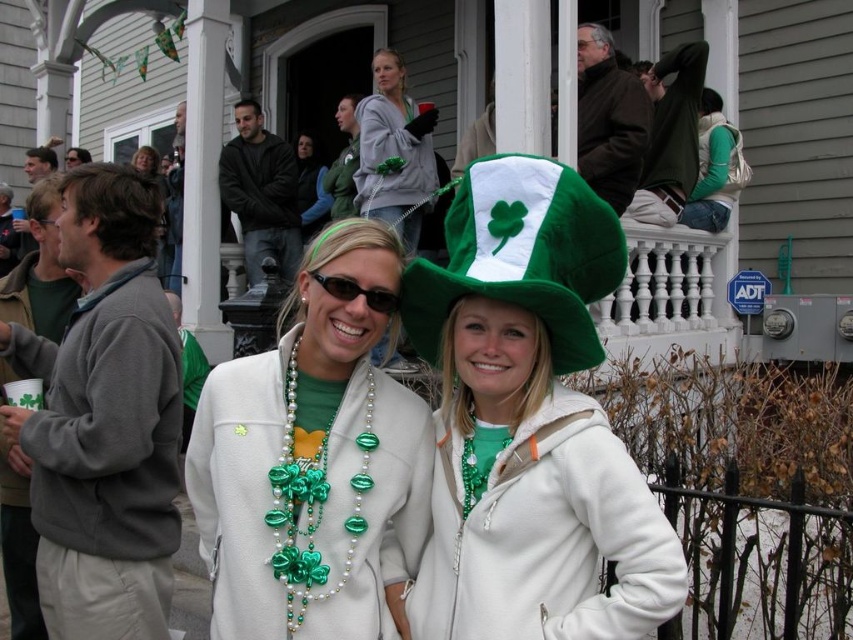
You are standing at the center of the image and want to locate the gray fleece sweatshirt at left. In which direction should you turn to face it?

The gray fleece sweatshirt at left is located at point (105, 460), which is to the left side of the image. Since you are facing the center, you should turn to your left to face it.

You are a photographer standing in front of the house. You want to take a photo that includes both the green fuzzy hat at center and the green beaded necklace at center. What is the minimum distance you need to move backward to ensure both objects are in the frame?

The green fuzzy hat at center and green beaded necklace at center are 1.36 meters apart. To include both in the frame, you need to move backward until the camera can capture a field of view that accommodates this distance. The exact distance depends on the camera lens, but generally, moving back by at least 1.36 meters or more would ensure both are visible.

Looking at this image, you are a photographer trying to capture a closeup of the green matte necklace at center and the green fabric vest at upper center. Which object should you focus on first to ensure it appears sharp in the photo?

The green matte necklace at center should be focused on first because it is in front of the green fabric vest at upper center, so focusing on the necklace will keep it sharp while the vest may appear slightly blurred due to its position behind.